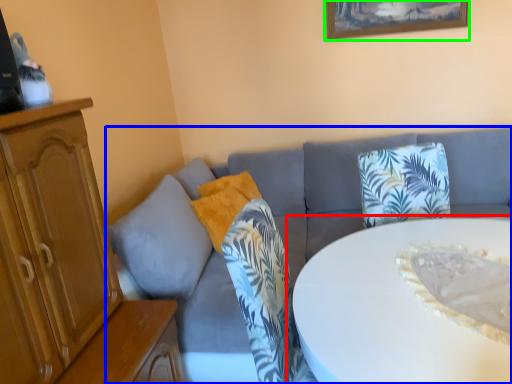
Question: Which is nearer to the table (highlighted by a red box)? studio couch (highlighted by a blue box) or picture frame (highlighted by a green box).

Choices:
 (A) studio couch
 (B) picture frame

Answer: (A)